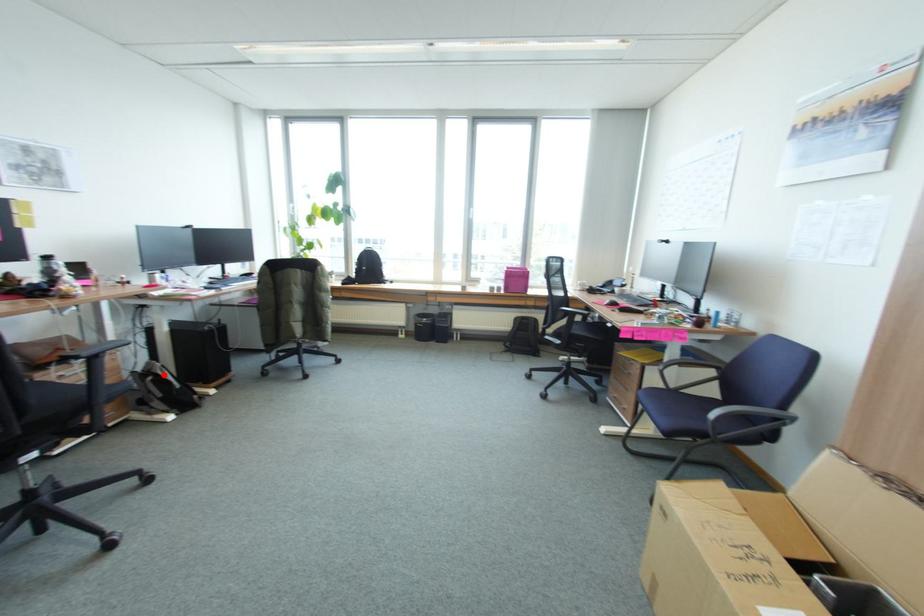
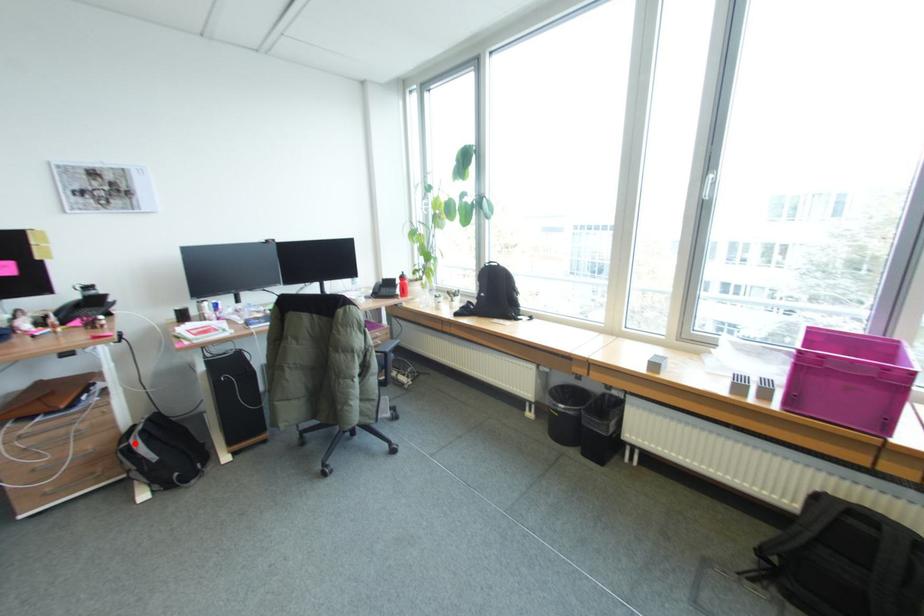
I am providing you with two images of the same scene from different viewpoints. A red point is marked on the first image and another point is marked on the second image. Are the points marked in image1 and image2 representing the same 3D position?

Yes